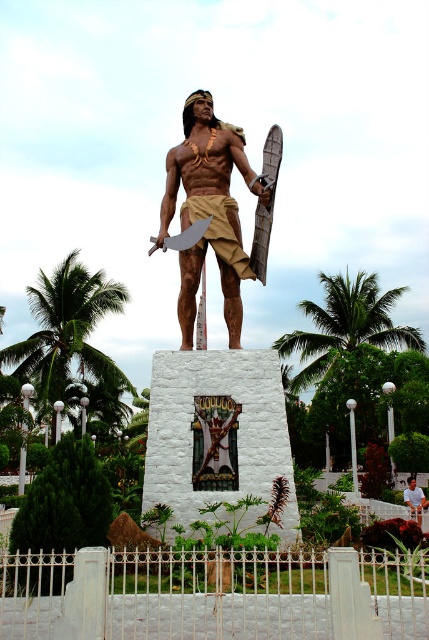
You are a park visitor wanting to take a photo of the wooden figure at center with the green leafy palm tree at left in the background. Can you position yourself so that the palm tree is fully visible behind the wooden figure without any overlap?

The green leafy palm tree at left is wider than the wooden figure at center, so positioning yourself so the palm tree is fully visible behind the wooden figure without overlap may be challenging due to its greater width.

You are standing in front of the statue and want to determine which of the two points, point (x=227, y=157) or point (x=42, y=404), is closer to you. Based on the statue and pedestal layout, which point is nearer?

Point (x=227, y=157) is closer to the viewer than point (x=42, y=404).

You are standing in the park and see the brown polished wood statue at center and the green leafy palm tree at left. Which object is located to the left of the other?

The green leafy palm tree at left is located to the left of the brown polished wood statue at center.